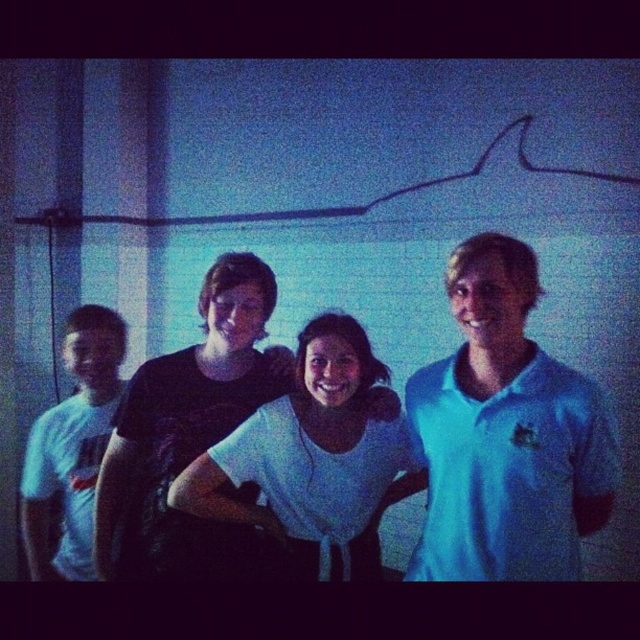
Question: Which of the following is the closest to the observer?

Choices:
 (A) (456, 525)
 (B) (106, 376)

Answer: (A)

Question: Does white matte polo shirt at right have a lesser width compared to white t-shirt at left?

Choices:
 (A) yes
 (B) no

Answer: (B)

Question: Among these objects, which one is nearest to the camera?

Choices:
 (A) white soft cotton shirt at center
 (B) white t-shirt at left

Answer: (A)

Question: Which point is closer to the camera?

Choices:
 (A) (481, 461)
 (B) (88, 500)

Answer: (A)

Question: Is white soft cotton shirt at center wider than white t-shirt at left?

Choices:
 (A) no
 (B) yes

Answer: (B)

Question: Does white matte polo shirt at right appear on the left side of white t-shirt at left?

Choices:
 (A) no
 (B) yes

Answer: (A)